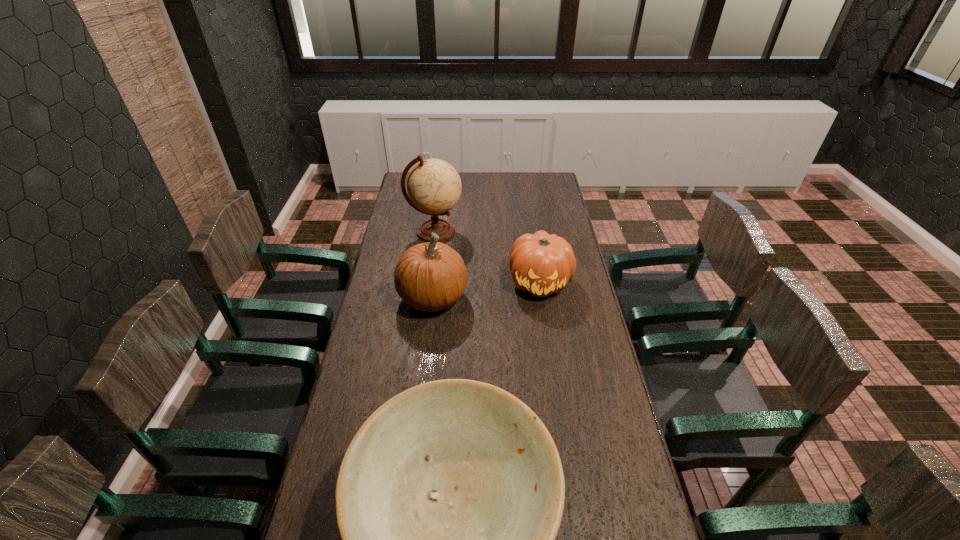
The height and width of the screenshot is (540, 960). Find the location of `object that is at the right edge`. object that is at the right edge is located at coordinates (541, 264).

You are a GUI agent. You are given a task and a screenshot of the screen. Output one action in this format:
    pyautogui.click(x=<x>, y=<y>)
    Task: Click on the free spot at the far edge of the desktop
    
    Given the screenshot: What is the action you would take?
    pyautogui.click(x=467, y=177)

Identify the location of free point at the left edge. Image resolution: width=960 pixels, height=540 pixels. (391, 252).

Where is `vacant area at the right edge`? The image size is (960, 540). vacant area at the right edge is located at coordinates (560, 202).

Image resolution: width=960 pixels, height=540 pixels. In order to click on free space between the tallest object and the right pumpkin in this screenshot , I will do `click(488, 257)`.

At what (x,y) coordinates should I click in order to perform the action: click on empty location between the left pumpkin and the shorter pumpkin. Please return your answer as a coordinate pair (x, y). The height and width of the screenshot is (540, 960). Looking at the image, I should click on (487, 291).

Locate an element on the screen. vacant space that is in between the left pumpkin and the shorter pumpkin is located at coordinates (487, 291).

Select which object is the second closest to the right pumpkin. Please provide its 2D coordinates. Your answer should be formatted as a tuple, i.e. [(x, y)], where the tuple contains the x and y coordinates of a point satisfying the conditions above.

[(434, 186)]

This screenshot has width=960, height=540. Identify the location of the third closest object to the nearest object. (434, 186).

Locate an element on the screen. free space that satisfies the following two spatial constraints: 1. on the carved face of the shorter pumpkin; 2. on the stem of the third shortest object is located at coordinates (542, 298).